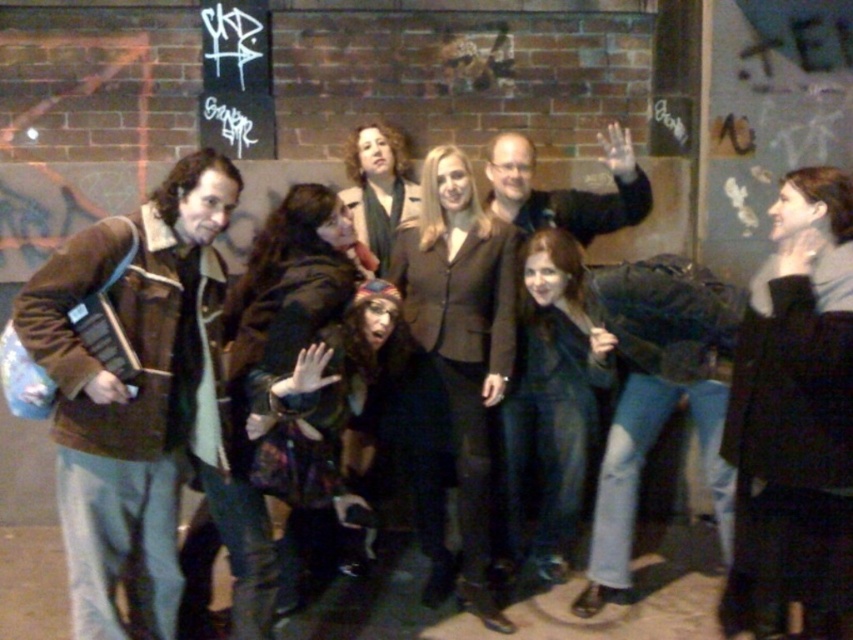
Is point (450, 568) closer to camera compared to point (622, 225)?

That is True.

The width and height of the screenshot is (853, 640). What do you see at coordinates (454, 369) in the screenshot?
I see `matte brown blazer at center` at bounding box center [454, 369].

Describe the element at coordinates (454, 369) in the screenshot. I see `matte brown blazer at center` at that location.

Locate an element on the screen. This screenshot has width=853, height=640. matte brown blazer at center is located at coordinates (454, 369).

Is matte brown blazer at center wider than plaid fabric jacket at center?

Indeed, matte brown blazer at center has a greater width compared to plaid fabric jacket at center.

Who is lower down, matte brown blazer at center or plaid fabric jacket at center?

matte brown blazer at center

Does point (497, 625) come behind point (259, 339)?

Yes, point (497, 625) is behind point (259, 339).

What are the coordinates of `matte brown blazer at center` in the screenshot? It's located at (454, 369).

Who is positioned more to the left, brown leather jacket at left or matte brown coat at center?

brown leather jacket at left

Is point (131, 589) positioned after point (364, 186)?

No.

This screenshot has height=640, width=853. What are the coordinates of `brown leather jacket at left` in the screenshot? It's located at tap(144, 404).